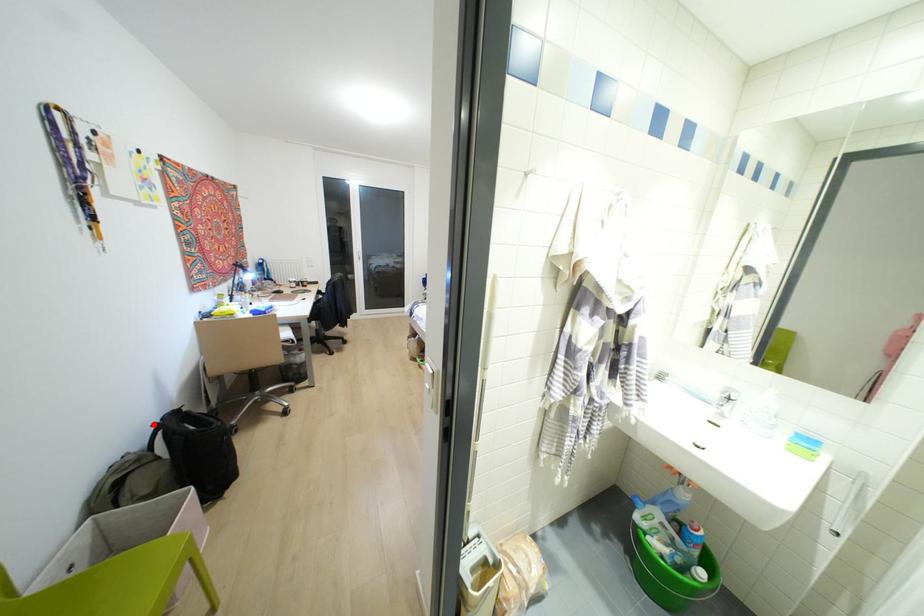
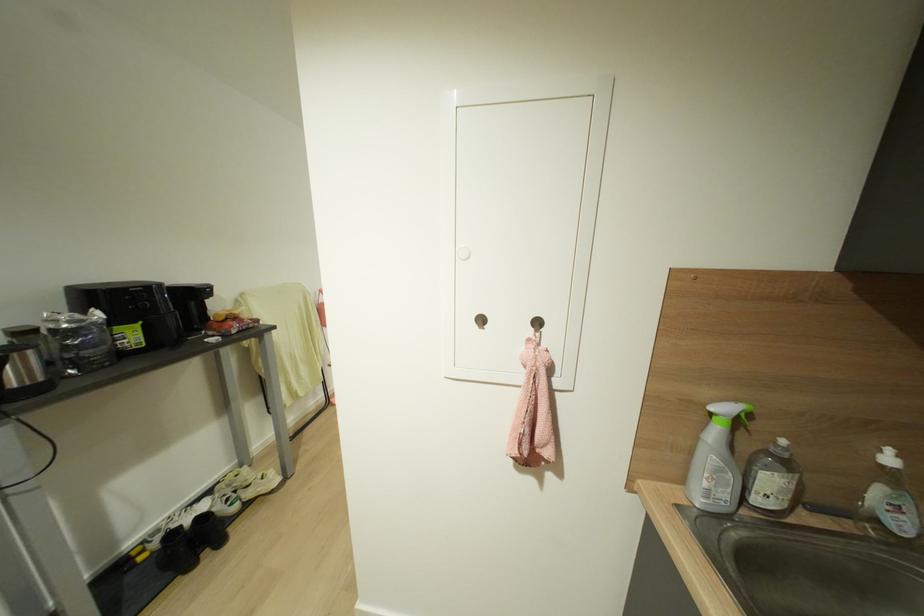
Question: I am providing you with two images of the same scene from different viewpoints. A red point is marked on the first image. Is the red point's position out of view in image 2?

Choices:
 (A) Yes
 (B) No

Answer: (A)